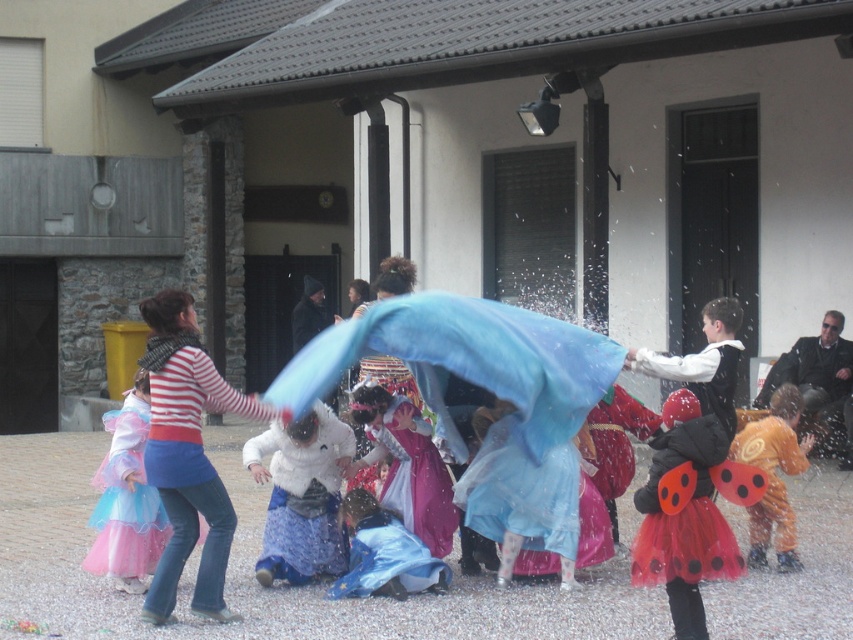
Image resolution: width=853 pixels, height=640 pixels. What do you see at coordinates (773, 476) in the screenshot? I see `orange fabric costume at center` at bounding box center [773, 476].

Can you confirm if orange fabric costume at center is positioned to the left of blue tulle skirt at lower center?

In fact, orange fabric costume at center is to the right of blue tulle skirt at lower center.

Between point (753, 506) and point (364, 493), which one is positioned in front?

Point (364, 493) is more forward.

Locate an element on the screen. The image size is (853, 640). orange fabric costume at center is located at coordinates (773, 476).

Is striped cotton shirt at center to the right of blue tulle skirt at lower center from the viewer's perspective?

In fact, striped cotton shirt at center is to the left of blue tulle skirt at lower center.

Does striped cotton shirt at center appear on the left side of blue tulle skirt at lower center?

Indeed, striped cotton shirt at center is positioned on the left side of blue tulle skirt at lower center.

Who is more forward, (173, 372) or (350, 524)?

Point (173, 372) is more forward.

This screenshot has height=640, width=853. Identify the location of striped cotton shirt at center. (187, 456).

Between blue fabric at center and striped cotton shirt at center, which one is positioned higher?

Positioned higher is blue fabric at center.

Can you confirm if blue fabric at center is positioned below striped cotton shirt at center?

Actually, blue fabric at center is above striped cotton shirt at center.

This screenshot has width=853, height=640. I want to click on blue fabric at center, so click(485, 388).

Find the location of a particular element. blue fabric at center is located at coordinates (485, 388).